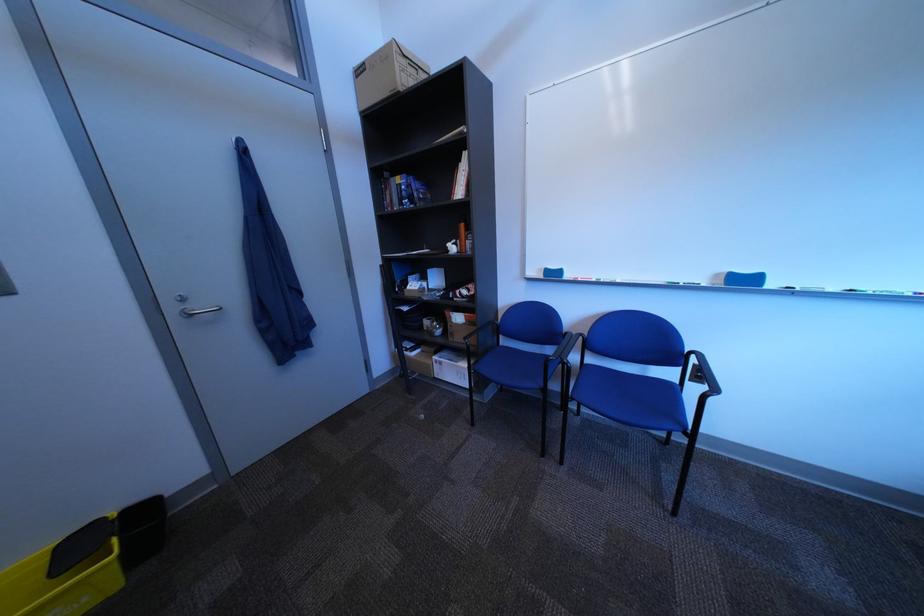
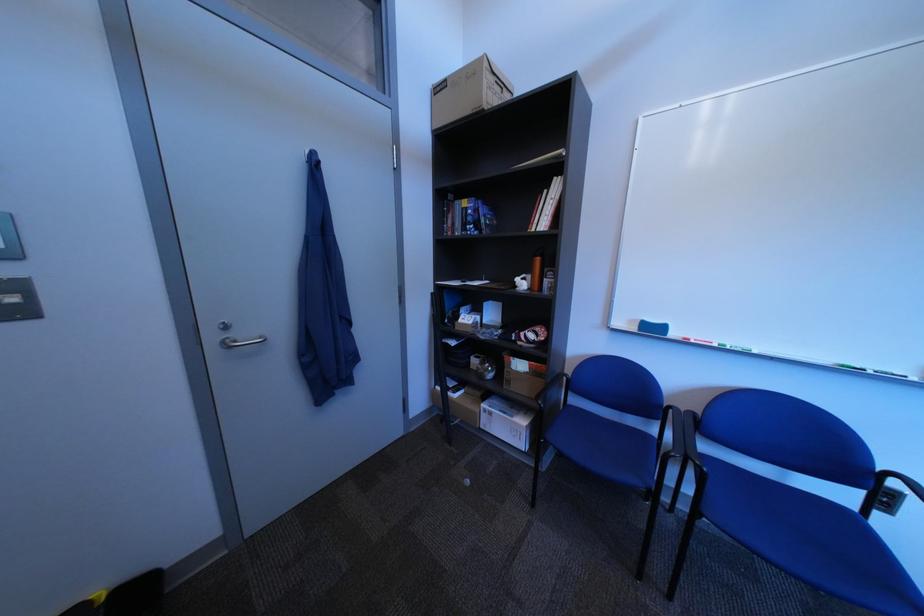
The point at (696, 370) is marked in the first image. Where is the corresponding point in the second image?

(881, 493)